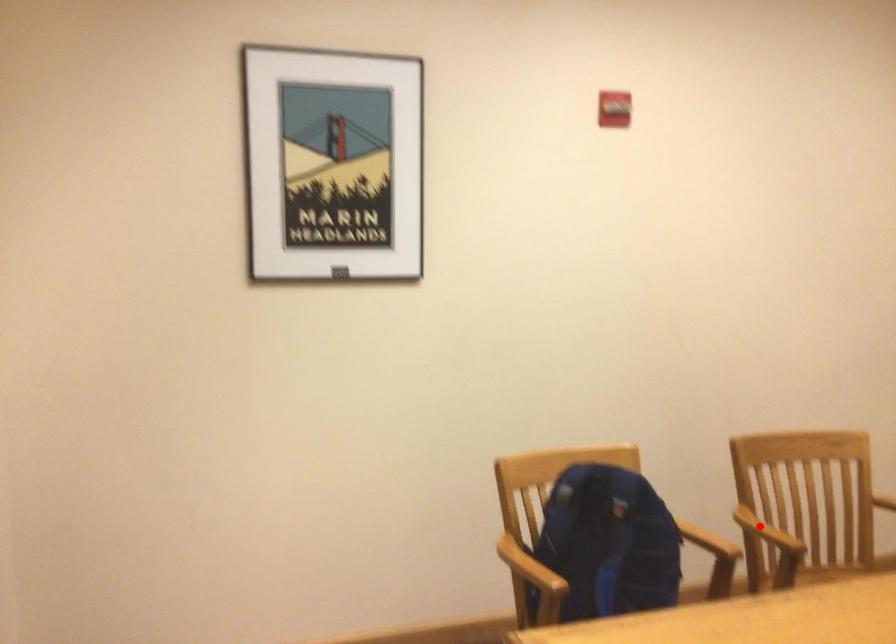
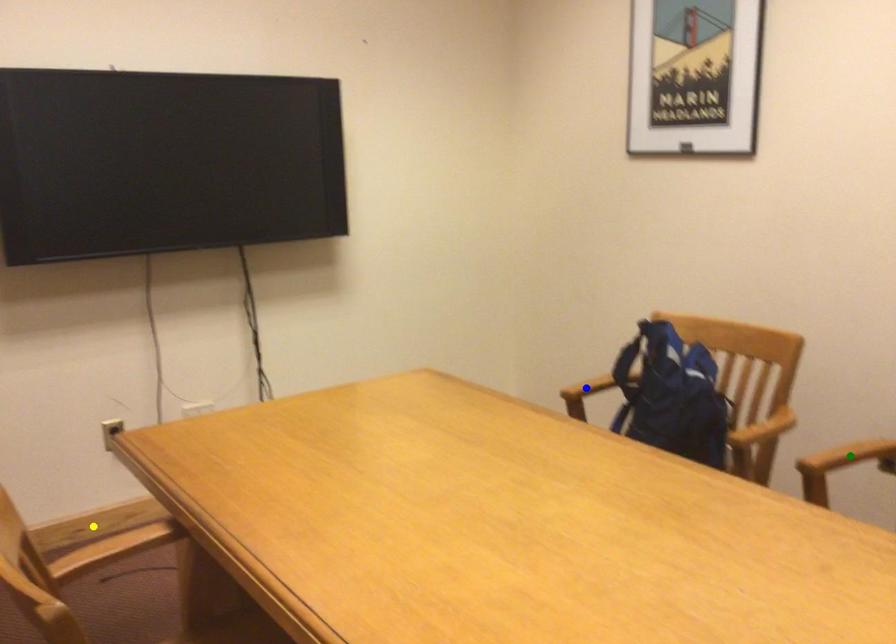
Question: I am providing you with two images of the same scene from different viewpoints. A red point is marked on the first image. You are given multiple points on the second image. Which spot in image 2 lines up with the point in image 1?

Choices:
 (A) blue point
 (B) green point
 (C) yellow point

Answer: (B)